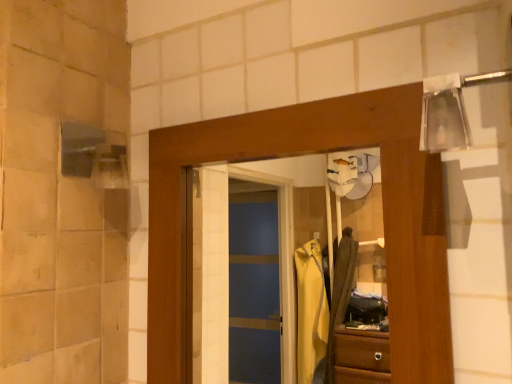
This screenshot has height=384, width=512. Describe the element at coordinates (298, 155) in the screenshot. I see `wooden door at center` at that location.

This screenshot has width=512, height=384. I want to click on wooden door at center, so click(x=298, y=155).

Measure the distance between point (390, 203) and camera.

They are 63.30 centimeters apart.

I want to click on wooden door at center, so click(298, 155).